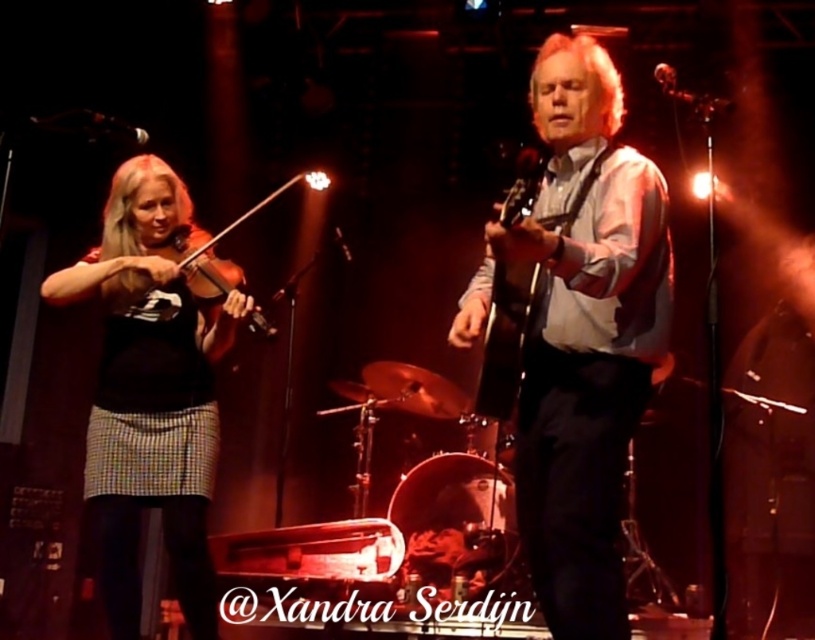
Question: Which of the following is the farthest from the observer?

Choices:
 (A) (490, 365)
 (B) (115, 552)

Answer: (B)

Question: Is matte white shirt at center wider than wooden violin at left?

Choices:
 (A) no
 (B) yes

Answer: (A)

Question: Can you confirm if glossy wood guitar at center is wider than wooden violin at left?

Choices:
 (A) no
 (B) yes

Answer: (A)

Question: Is black matte violin at left closer to the viewer compared to wooden violin at left?

Choices:
 (A) yes
 (B) no

Answer: (A)

Question: Which is farther from the glossy wood guitar at center?

Choices:
 (A) matte white shirt at center
 (B) wooden violin at left
 (C) black matte violin at left

Answer: (B)

Question: Which object is the closest to the glossy wood guitar at center?

Choices:
 (A) matte white shirt at center
 (B) wooden violin at left
 (C) black matte violin at left

Answer: (A)